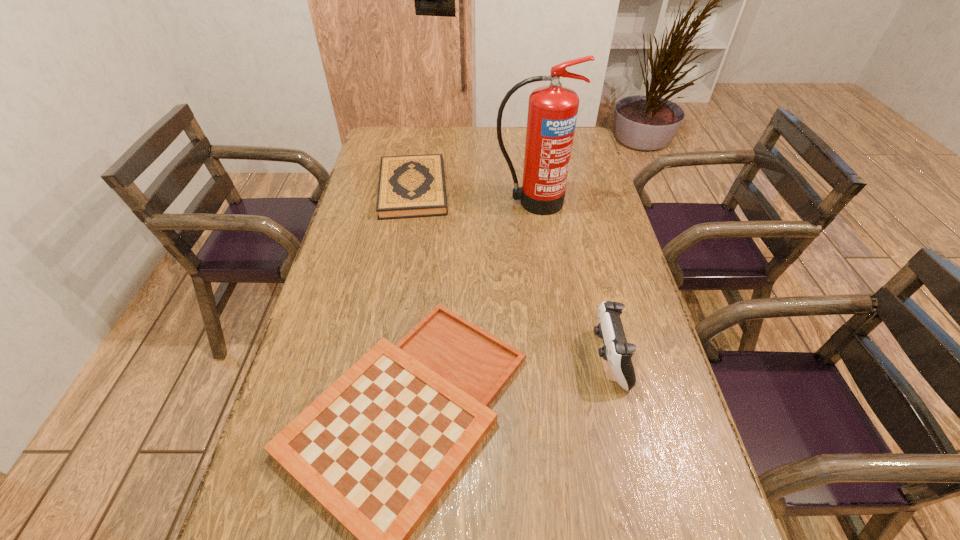
This screenshot has height=540, width=960. I want to click on fire extinguisher, so click(x=552, y=110).

The height and width of the screenshot is (540, 960). What are the coordinates of `control` in the screenshot? It's located at (616, 351).

Find the location of a particular element. the third tallest object is located at coordinates (410, 186).

At what (x,y) coordinates should I click in order to perform the action: click on free space located 0.200m on the surface of the tallest object. Please return your answer as a coordinate pair (x, y). This screenshot has width=960, height=540. Looking at the image, I should click on (540, 257).

In order to click on free location located on the front-facing side of the control in this screenshot , I will do `click(515, 357)`.

Identify the location of vacant space located 0.150m on the front-facing side of the control. Image resolution: width=960 pixels, height=540 pixels. (531, 357).

The image size is (960, 540). What are the coordinates of `free spot located on the front-facing side of the control` in the screenshot? It's located at (493, 357).

The width and height of the screenshot is (960, 540). Find the location of `vacant space situated 0.060m on the back of the hardback book`. vacant space situated 0.060m on the back of the hardback book is located at coordinates (420, 154).

Image resolution: width=960 pixels, height=540 pixels. Identify the location of object that is at the left edge. (410, 186).

This screenshot has height=540, width=960. In order to click on fire extinguisher that is at the right edge in this screenshot , I will do `click(552, 110)`.